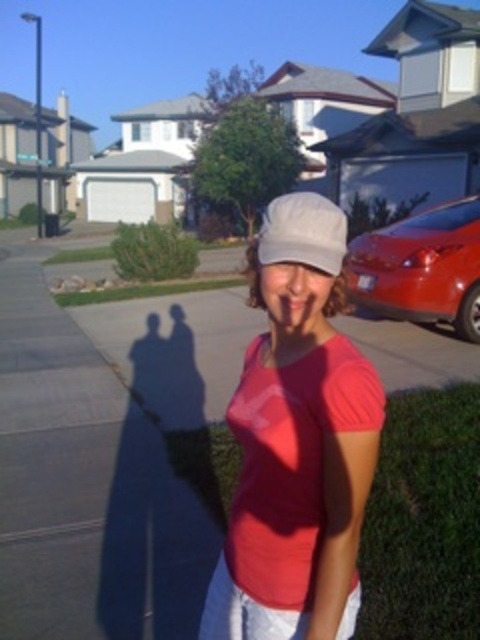
Question: Is smooth concrete pavement at center smaller than matte white cap at center?

Choices:
 (A) no
 (B) yes

Answer: (A)

Question: Which point is closer to the camera?

Choices:
 (A) (214, 326)
 (B) (325, 243)

Answer: (B)

Question: Which point is farther to the camera?

Choices:
 (A) shiny red car at right
 (B) smooth concrete pavement at center
 (C) matte white cap at center
 (D) white matte hat at center

Answer: (A)

Question: Is smooth concrete pavement at center to the right of shiny red car at right from the viewer's perspective?

Choices:
 (A) yes
 (B) no

Answer: (B)

Question: Which of the following is the farthest from the observer?

Choices:
 (A) (265, 209)
 (B) (249, 349)
 (C) (206, 436)
 (D) (465, 284)

Answer: (A)

Question: Does matte white cap at center appear under white matte hat at center?

Choices:
 (A) yes
 (B) no

Answer: (A)